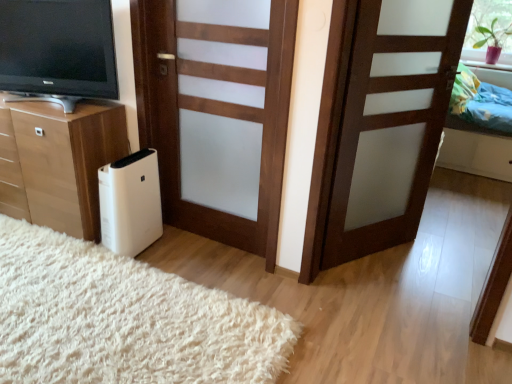
Question: Can you confirm if brown matte door at center, which is the second door in left-to-right order, is wider than white soft rug at lower left?

Choices:
 (A) yes
 (B) no

Answer: (B)

Question: Considering the relative sizes of brown matte door at center, which appears as the first door when viewed from the right, and white soft rug at lower left in the image provided, is brown matte door at center, which appears as the first door when viewed from the right, bigger than white soft rug at lower left?

Choices:
 (A) no
 (B) yes

Answer: (A)

Question: Considering the relative sizes of brown matte door at center, which appears as the first door when viewed from the right, and white soft rug at lower left in the image provided, is brown matte door at center, which appears as the first door when viewed from the right, smaller than white soft rug at lower left?

Choices:
 (A) yes
 (B) no

Answer: (A)

Question: From a real-world perspective, is brown matte door at center, which appears as the first door when viewed from the right, located beneath white soft rug at lower left?

Choices:
 (A) no
 (B) yes

Answer: (A)

Question: Does brown matte door at center, which appears as the first door when viewed from the right, have a lesser height compared to white soft rug at lower left?

Choices:
 (A) yes
 (B) no

Answer: (B)

Question: Which is correct: wooden door at center, marked as the first door in a left-to-right arrangement, is inside green matte plant at upper right, or outside of it?

Choices:
 (A) outside
 (B) inside

Answer: (A)

Question: Is point (188, 140) closer or farther from the camera than point (499, 43)?

Choices:
 (A) farther
 (B) closer

Answer: (B)

Question: Is wooden door at center, marked as the first door in a left-to-right arrangement, wider or thinner than green matte plant at upper right?

Choices:
 (A) thin
 (B) wide

Answer: (B)

Question: From the image's perspective, is wooden door at center, marked as the first door in a left-to-right arrangement, positioned above or below green matte plant at upper right?

Choices:
 (A) below
 (B) above

Answer: (A)

Question: Is brown matte door at center, which is the second door in left-to-right order, to the left or to the right of white plastic air purifier at lower left in the image?

Choices:
 (A) left
 (B) right

Answer: (B)

Question: From the image's perspective, relative to white plastic air purifier at lower left, is brown matte door at center, which is the second door in left-to-right order, above or below?

Choices:
 (A) above
 (B) below

Answer: (A)

Question: In the image, is brown matte door at center, which is the second door in left-to-right order, positioned in front of or behind white plastic air purifier at lower left?

Choices:
 (A) front
 (B) behind

Answer: (A)

Question: From a real-world perspective, is brown matte door at center, which appears as the first door when viewed from the right, above or below white plastic air purifier at lower left?

Choices:
 (A) above
 (B) below

Answer: (A)

Question: From their relative heights in the image, would you say matte black television at left is taller or shorter than wooden chest of drawers at lower left?

Choices:
 (A) short
 (B) tall

Answer: (A)

Question: Looking at the image, does matte black television at left seem bigger or smaller compared to wooden chest of drawers at lower left?

Choices:
 (A) small
 (B) big

Answer: (A)